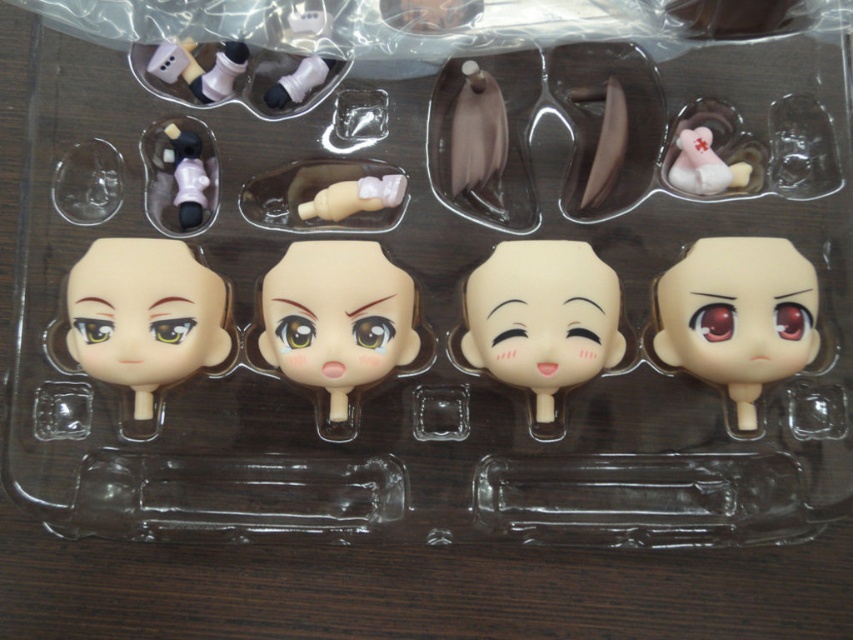
You are a collector organizing a display case. You have two items to place in the case, the smooth beige face at center and the matte pink plastic doll at upper left. According to the image, where should you position them relative to each other to match the original arrangement?

The smooth beige face at center should be placed below the matte pink plastic doll at upper left to maintain the original positioning as seen in the image.